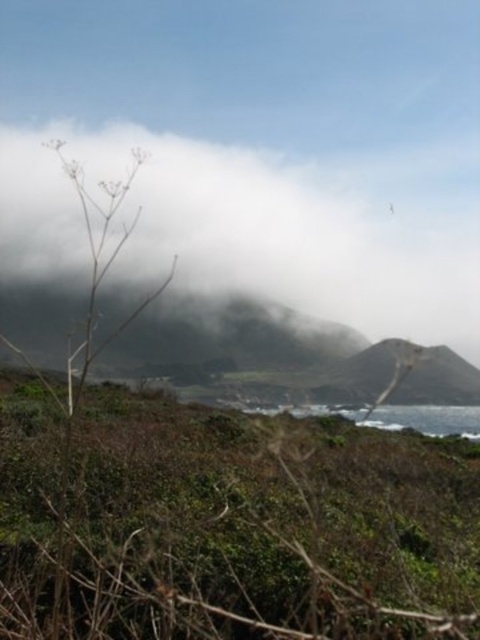
Question: Is green leafy shrubs at center further to camera compared to white fluffy cloud at upper center?

Choices:
 (A) no
 (B) yes

Answer: (A)

Question: Is green leafy shrubs at center to the left of white fluffy cloud at upper center from the viewer's perspective?

Choices:
 (A) no
 (B) yes

Answer: (B)

Question: Can you confirm if green leafy shrubs at center is positioned below white fluffy cloud at upper center?

Choices:
 (A) no
 (B) yes

Answer: (B)